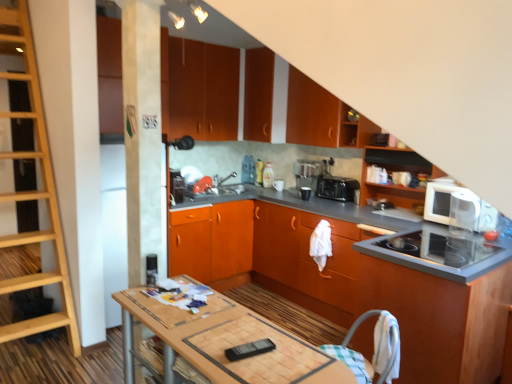
Question: From a real-world perspective, is black plastic toaster at center positioned over matte orange cabinet at upper center, the seventh cabinetry in the bottom-to-top sequence, based on gravity?

Choices:
 (A) no
 (B) yes

Answer: (A)

Question: Is black plastic toaster at center wider than matte orange cabinet at upper center, the seventh cabinetry in the bottom-to-top sequence?

Choices:
 (A) yes
 (B) no

Answer: (B)

Question: Is black plastic toaster at center outside matte orange cabinet at upper center, the seventh cabinetry in the bottom-to-top sequence?

Choices:
 (A) yes
 (B) no

Answer: (A)

Question: Can you confirm if black plastic toaster at center is smaller than matte orange cabinet at upper center, the seventh cabinetry in the bottom-to-top sequence?

Choices:
 (A) no
 (B) yes

Answer: (B)

Question: Does black plastic toaster at center touch matte orange cabinet at upper center, which is the 1th cabinetry in top-to-bottom order?

Choices:
 (A) yes
 (B) no

Answer: (B)

Question: Does black plastic toaster at center have a lesser width compared to matte orange cabinet at upper center, the seventh cabinetry in the bottom-to-top sequence?

Choices:
 (A) no
 (B) yes

Answer: (B)

Question: Is metallic silver toaster at center, acting as the second appliance starting from the bottom, further to camera compared to satin black coffee machine at center?

Choices:
 (A) no
 (B) yes

Answer: (A)

Question: From a real-world perspective, is metallic silver toaster at center, arranged as the 1th appliance when viewed from the left, positioned over satin black coffee machine at center based on gravity?

Choices:
 (A) yes
 (B) no

Answer: (B)

Question: Considering the relative sizes of metallic silver toaster at center, the 2th appliance from the front, and satin black coffee machine at center in the image provided, is metallic silver toaster at center, the 2th appliance from the front, taller than satin black coffee machine at center?

Choices:
 (A) no
 (B) yes

Answer: (A)

Question: Does metallic silver toaster at center, arranged as the 1th appliance when viewed from the left, appear on the left side of satin black coffee machine at center?

Choices:
 (A) yes
 (B) no

Answer: (A)

Question: Considering the relative sizes of metallic silver toaster at center, acting as the first appliance starting from the top, and satin black coffee machine at center in the image provided, is metallic silver toaster at center, acting as the first appliance starting from the top, bigger than satin black coffee machine at center?

Choices:
 (A) yes
 (B) no

Answer: (B)

Question: Is satin black coffee machine at center inside metallic silver toaster at center, acting as the second appliance starting from the bottom?

Choices:
 (A) no
 (B) yes

Answer: (A)

Question: Considering the relative sizes of matte orange cabinet at upper center, which is the 1th cabinetry in top-to-bottom order, and satin black coffee machine at center in the image provided, is matte orange cabinet at upper center, which is the 1th cabinetry in top-to-bottom order, smaller than satin black coffee machine at center?

Choices:
 (A) no
 (B) yes

Answer: (A)